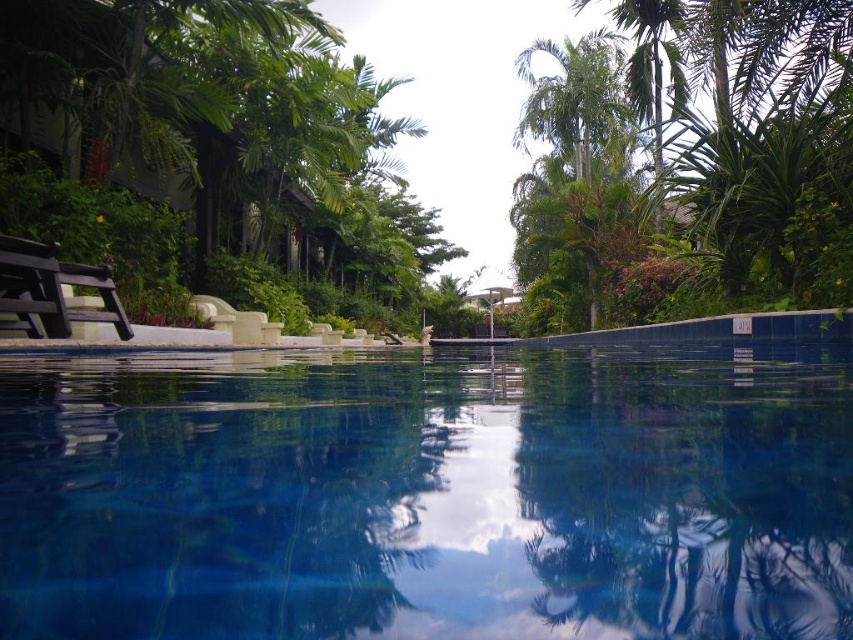
Does blue tile swimming pool at center appear on the right side of green leafy tree at left?

Indeed, blue tile swimming pool at center is positioned on the right side of green leafy tree at left.

Does point (843, 611) lie behind point (320, 29)?

No, it is not.

Does point (563, 570) lie in front of point (283, 58)?

Yes, point (563, 570) is in front of point (283, 58).

I want to click on blue tile swimming pool at center, so click(x=432, y=493).

Between blue tile swimming pool at center and green leafy palm tree at center, which one has more height?

Standing taller between the two is green leafy palm tree at center.

Does point (96, 445) come in front of point (566, 291)?

Yes, point (96, 445) is in front of point (566, 291).

The width and height of the screenshot is (853, 640). In order to click on blue tile swimming pool at center in this screenshot , I will do `click(432, 493)`.

At what (x,y) coordinates should I click in order to perform the action: click on blue tile swimming pool at center. Please return your answer as a coordinate pair (x, y). The image size is (853, 640). Looking at the image, I should click on (432, 493).

Between green leafy palm tree at center and dark brown wooden chair at left, which one has more height?

green leafy palm tree at center is taller.

Is point (564, 179) positioned in front of point (16, 257)?

No, it is not.

Locate an element on the screen. green leafy palm tree at center is located at coordinates (573, 173).